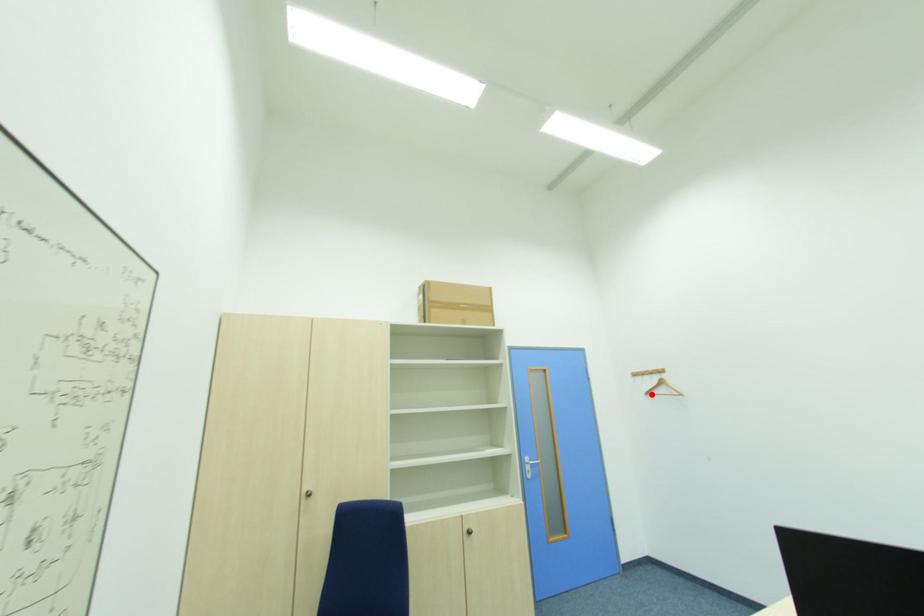
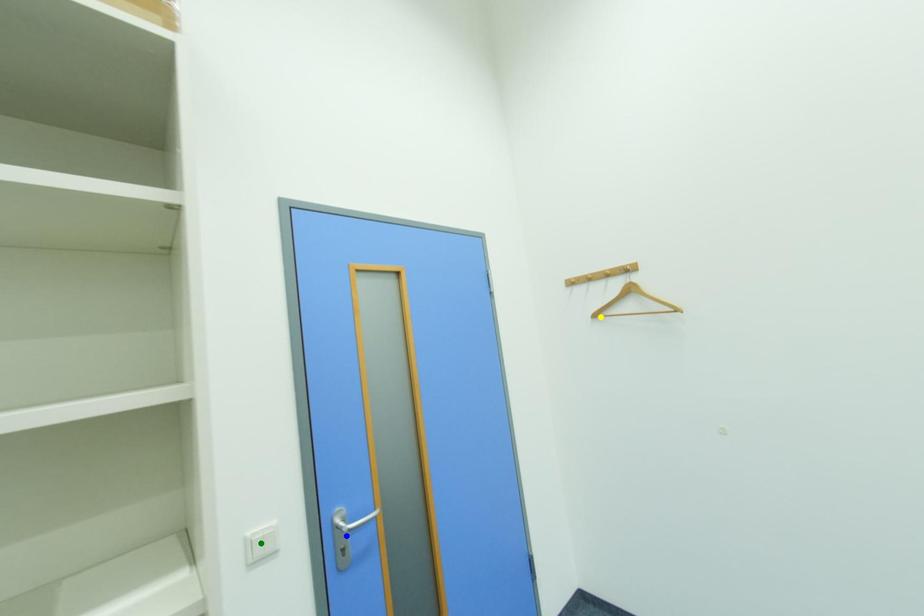
Question: I am providing you with two images of the same scene from different viewpoints. A red point is marked on the first image. You are given multiple points on the second image. Which point in image 2 represents the same 3d spot as the red point in image 1?

Choices:
 (A) green point
 (B) yellow point
 (C) blue point

Answer: (B)